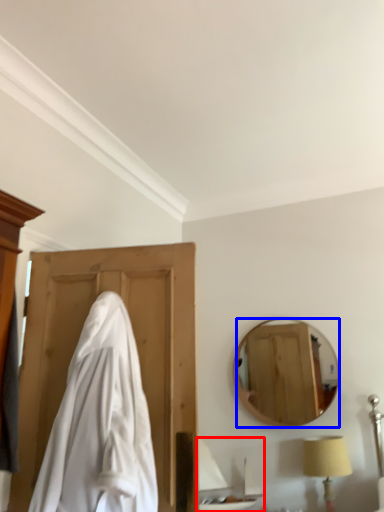
Question: Which of the following is the closest to the observer, sink (highlighted by a red box) or mirror (highlighted by a blue box)?

Choices:
 (A) sink
 (B) mirror

Answer: (A)